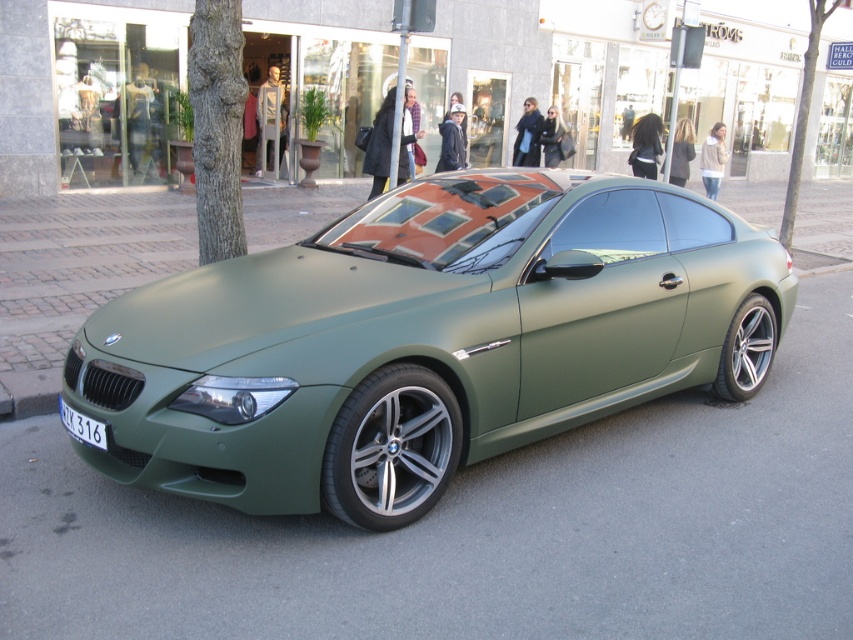
You are a delivery driver who needs to park your vehicle in a spot that requires the license plate to be visible. Given the positioning of the matte green car at center and the white plastic license plate at lower left, can you determine if the license plate is visible when the car is parked as shown?

The matte green car at center is positioned over the white plastic license plate at lower left, which means the license plate is likely obstructed and not visible from the required angle for parking.